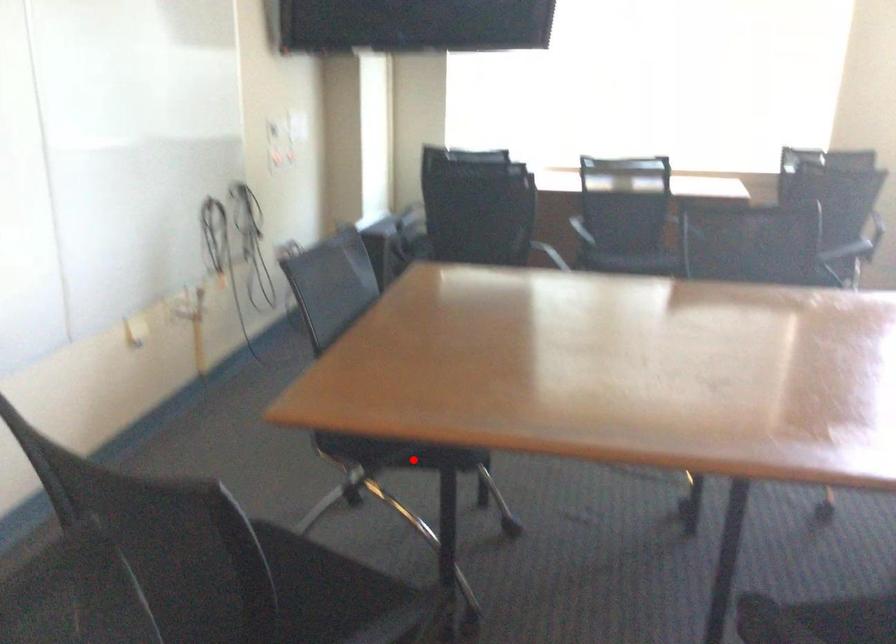
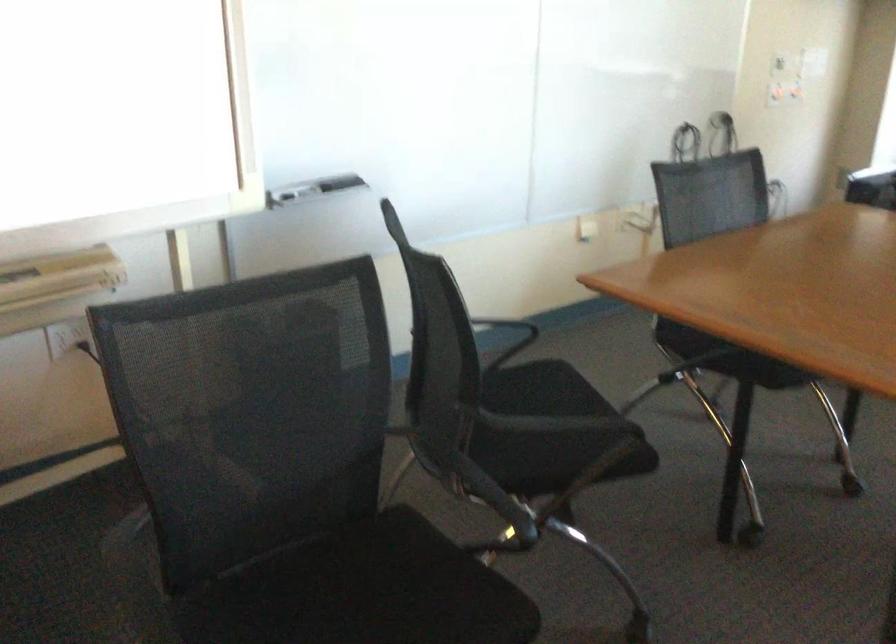
The point at the highlighted location is marked in the first image. Where is the corresponding point in the second image?

(728, 357)